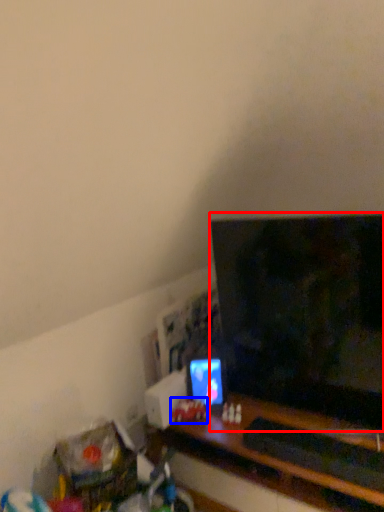
Question: Which object is further to the camera taking this photo, television (highlighted by a red box) or toy (highlighted by a blue box)?

Choices:
 (A) television
 (B) toy

Answer: (B)